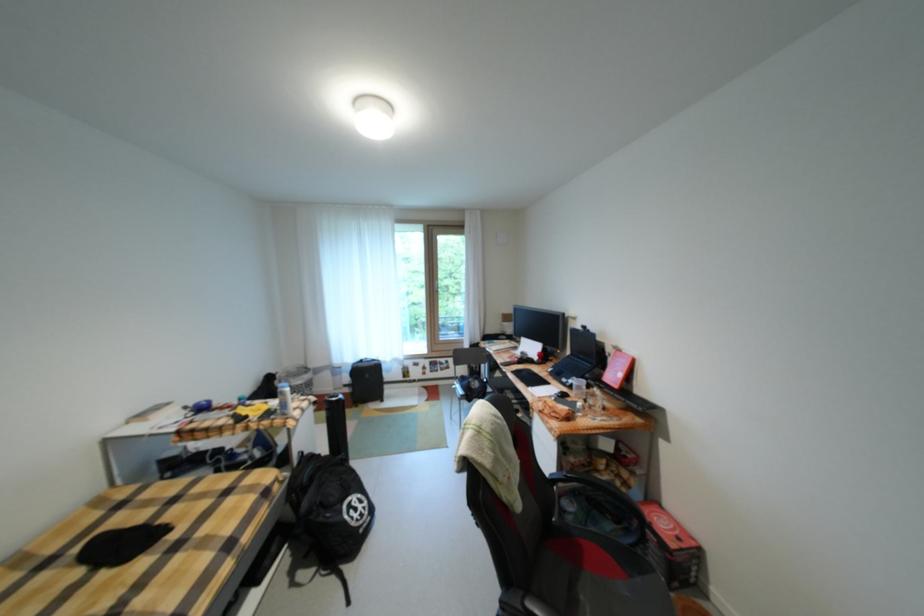
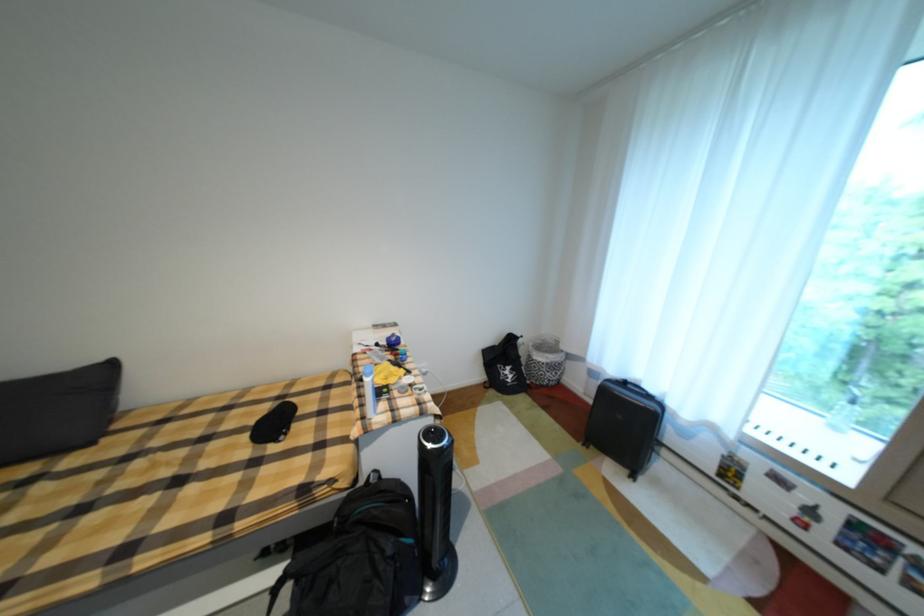
In the second image, find the point that corresponds to pixel 201 415 in the first image.

(394, 344)